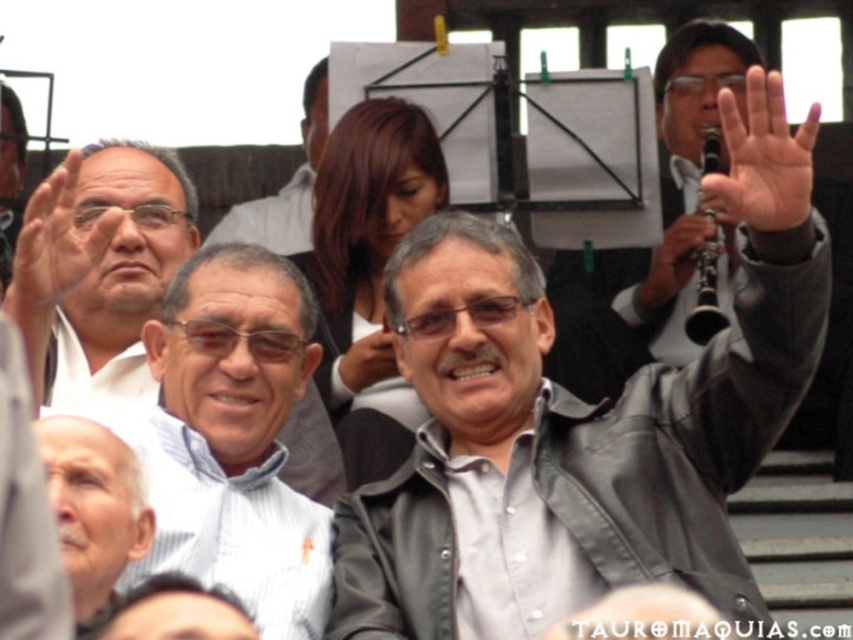
Question: Is leather jacket at center to the left of black leather jacket at upper right from the viewer's perspective?

Choices:
 (A) yes
 (B) no

Answer: (A)

Question: Is leather jacket at center bigger than black leather clarinet at upper right?

Choices:
 (A) no
 (B) yes

Answer: (B)

Question: Among these objects, which one is farthest from the camera?

Choices:
 (A) white striped shirt at left
 (B) white striped shirt at center
 (C) matte white shirt at upper center

Answer: (C)

Question: Which object is positioned farthest from the gray hair at lower left?

Choices:
 (A) transparent plastic hand at upper left
 (B) leather jacket at center
 (C) white striped shirt at left

Answer: (B)

Question: Which object is farther from the camera taking this photo?

Choices:
 (A) matte white shirt at upper center
 (B) white striped shirt at center
 (C) leather jacket at center
 (D) transparent plastic hand at upper left

Answer: (A)

Question: Does white striped shirt at left appear on the right side of black leather jacket at upper right?

Choices:
 (A) no
 (B) yes

Answer: (A)